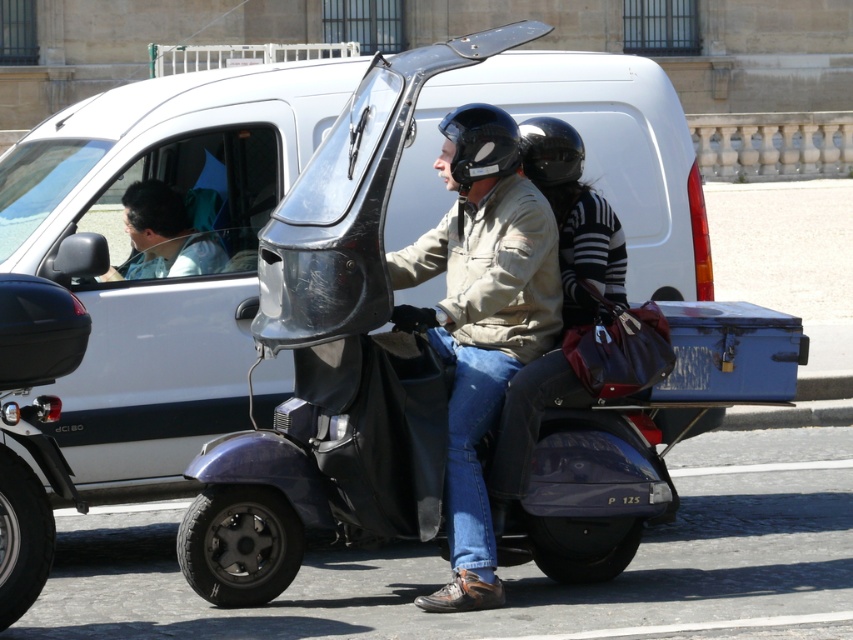
Question: Considering the relative positions of matte khaki jacket at center and black glossy helmet at upper center in the image provided, where is matte khaki jacket at center located with respect to black glossy helmet at upper center?

Choices:
 (A) above
 (B) below

Answer: (B)

Question: Which of the following is the closest to the observer?

Choices:
 (A) black glossy helmet at upper center
 (B) matte khaki jacket at center
 (C) light blue shirt at left

Answer: (B)

Question: Is black matte helmet at center closer to the viewer compared to black glossy helmet at upper center?

Choices:
 (A) yes
 (B) no

Answer: (A)

Question: Which object appears farthest from the camera in this image?

Choices:
 (A) light blue shirt at left
 (B) black glossy helmet at upper center
 (C) black matte helmet at center
 (D) matte khaki jacket at center

Answer: (A)

Question: Does black matte helmet at center appear on the right side of black glossy helmet at upper center?

Choices:
 (A) yes
 (B) no

Answer: (B)

Question: Which object is positioned closest to the matte khaki jacket at center?

Choices:
 (A) black matte helmet at center
 (B) black glossy helmet at upper center

Answer: (A)